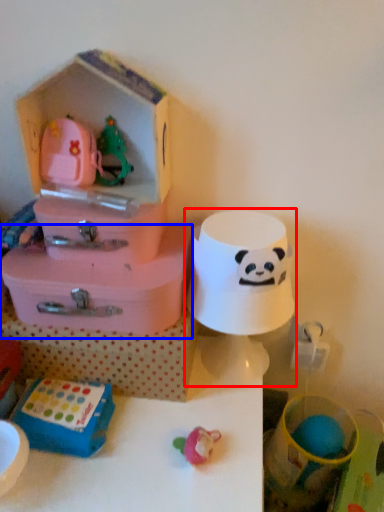
Question: Which of the following is the farthest to the observer, toy (highlighted by a red box) or storage box (highlighted by a blue box)?

Choices:
 (A) toy
 (B) storage box

Answer: (B)